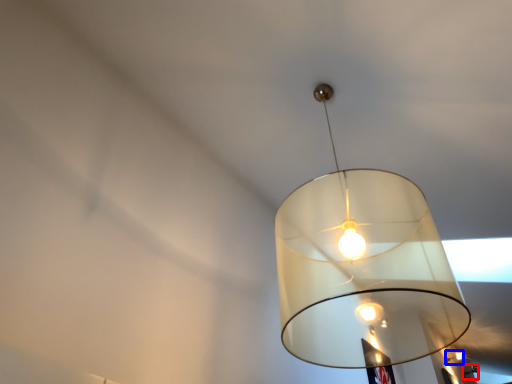
Question: Which of the following is the closest to the observer, lamp (highlighted by a red box) or lamp (highlighted by a blue box)?

Choices:
 (A) lamp
 (B) lamp

Answer: (B)